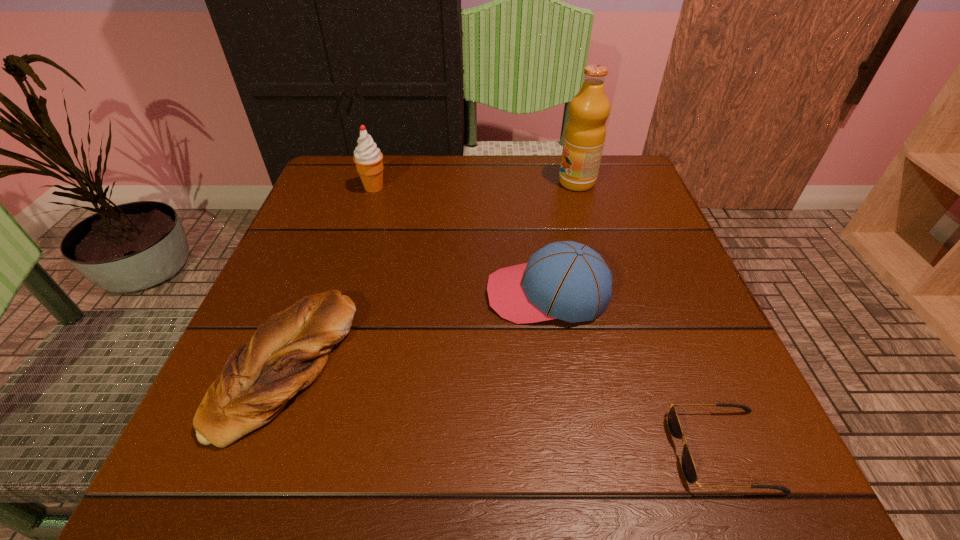
I want to click on free space between the bread and the third tallest object, so click(418, 329).

Find the location of `free space between the third shortest object and the tallest object`. free space between the third shortest object and the tallest object is located at coordinates (563, 238).

The width and height of the screenshot is (960, 540). In order to click on free space that is in between the baseball cap and the icecream in this screenshot , I will do `click(461, 241)`.

Where is `empty space between the third tallest object and the fourth tallest object`? Image resolution: width=960 pixels, height=540 pixels. empty space between the third tallest object and the fourth tallest object is located at coordinates (418, 329).

At what (x,y) coordinates should I click in order to perform the action: click on object that is the third closest one to the baseball cap. Please return your answer as a coordinate pair (x, y). The height and width of the screenshot is (540, 960). Looking at the image, I should click on (585, 132).

The height and width of the screenshot is (540, 960). Find the location of `object that can be found as the fourth closest to the bread`. object that can be found as the fourth closest to the bread is located at coordinates (585, 132).

The width and height of the screenshot is (960, 540). In order to click on free space that satisfies the following two spatial constraints: 1. on the front label of the fruit juice; 2. on the front side of the fourth tallest object in this screenshot , I will do `click(631, 366)`.